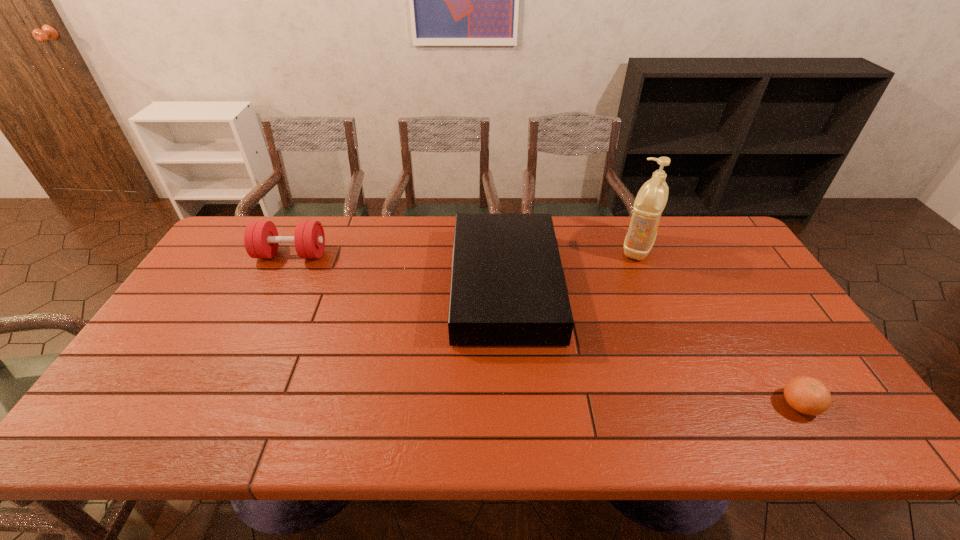
Find the location of a particular element. vacant region located 0.140m at the front of the second shortest object for disc insertion is located at coordinates (407, 286).

Image resolution: width=960 pixels, height=540 pixels. I want to click on vacant region located at the front of the second shortest object for disc insertion, so click(x=390, y=286).

Find the location of a particular element. The width and height of the screenshot is (960, 540). vacant space situated 0.340m at the front of the second shortest object for disc insertion is located at coordinates point(340,286).

Locate an element on the screen. Image resolution: width=960 pixels, height=540 pixels. vacant area situated 0.140m on the left of the shortest object is located at coordinates (720, 404).

The image size is (960, 540). Find the location of `detergent at the far edge`. detergent at the far edge is located at coordinates (652, 197).

Identify the location of dumbbell present at the far edge. (261, 240).

Where is `CD player that is at the far edge`? Image resolution: width=960 pixels, height=540 pixels. CD player that is at the far edge is located at coordinates (508, 288).

Find the location of a particular element. Image resolution: width=960 pixels, height=540 pixels. object at the near edge is located at coordinates (807, 395).

At what (x,y) coordinates should I click in order to perform the action: click on object present at the left edge. Please return your answer as a coordinate pair (x, y). Looking at the image, I should click on (261, 240).

At what (x,y) coordinates should I click in order to perform the action: click on object that is at the right edge. Please return your answer as a coordinate pair (x, y). The width and height of the screenshot is (960, 540). Looking at the image, I should click on (807, 395).